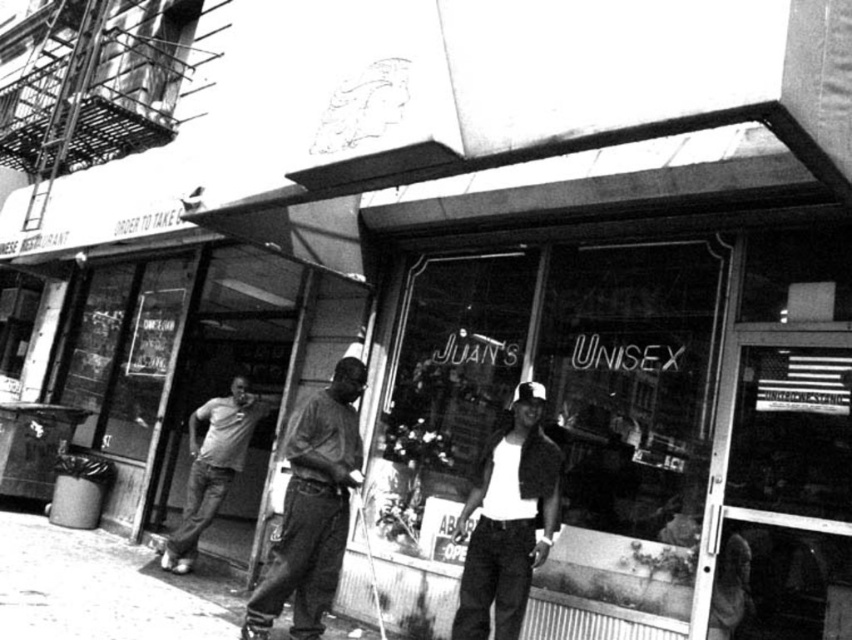
Is white matte shirt at center positioned in front of light gray t-shirt at center?

Yes, white matte shirt at center is in front of light gray t-shirt at center.

Between point (464, 586) and point (235, 428), which one is positioned in front?

Point (464, 586) is in front.

The image size is (852, 640). What are the coordinates of `white matte shirt at center` in the screenshot? It's located at (507, 522).

Based on the photo, can you confirm if transparent glass window at center is thinner than white matte shirt at center?

No, transparent glass window at center is not thinner than white matte shirt at center.

Does transparent glass window at center have a greater width compared to white matte shirt at center?

Yes.

The height and width of the screenshot is (640, 852). What are the coordinates of `transparent glass window at center` in the screenshot? It's located at (629, 426).

From the picture: Is dark gray jeans at center above white matte shirt at center?

Yes, dark gray jeans at center is above white matte shirt at center.

Can you confirm if dark gray jeans at center is smaller than white matte shirt at center?

Correct, dark gray jeans at center occupies less space than white matte shirt at center.

Measure the distance between dark gray jeans at center and camera.

A: They are 10.21 feet apart.

The width and height of the screenshot is (852, 640). What are the coordinates of `dark gray jeans at center` in the screenshot? It's located at (312, 508).